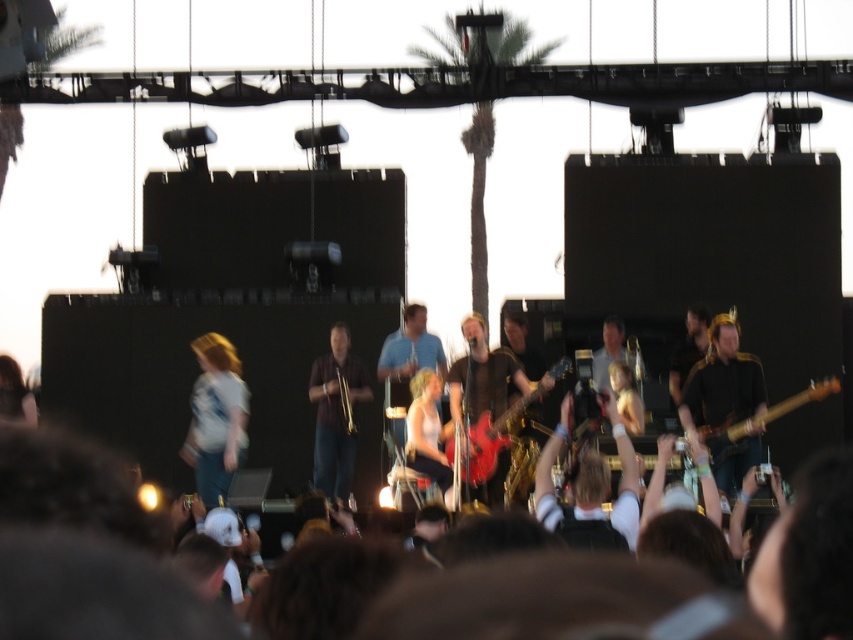
You are a photographer at the concert and want to capture both the shiny red electric guitar at center and the brown wooden guitar at right in a single shot. Which guitar should you focus on first to ensure both are in frame, considering their sizes?

The shiny red electric guitar at center is thinner than the brown wooden guitar at right, so focusing on the brown wooden guitar at right first would allow enough space for both guitars to fit in the frame since it is wider.

You are a photographer standing at the front row of the concert. You want to take a closeup photo of the shiny red electric guitar at center. The camera you are using has a maximum zoom range of 100 meters. Can you capture the guitar clearly with your current camera settings?

The shiny red electric guitar at center is 117.37 meters away from the camera. Since the camera can only zoom up to 100 meters, it cannot capture the guitar clearly at this distance.

You are a photographer at the concert and want to capture both the shiny red electric guitar at center and the brown wooden guitar at right in a single shot. Based on their positions, which guitar should you focus on first to ensure both are in frame?

The shiny red electric guitar at center is above the brown wooden guitar at right, so focusing on the center guitar first will allow both to be captured in the frame.